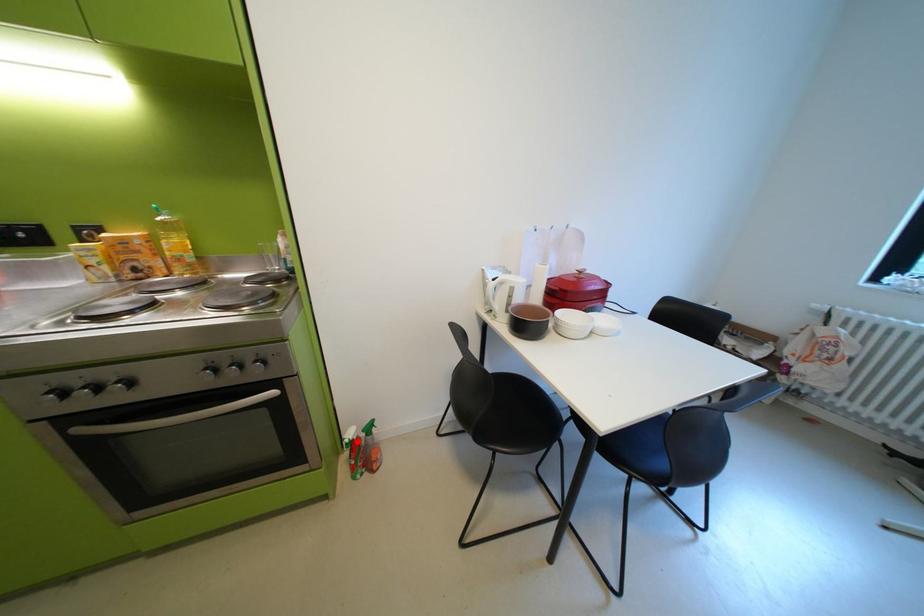
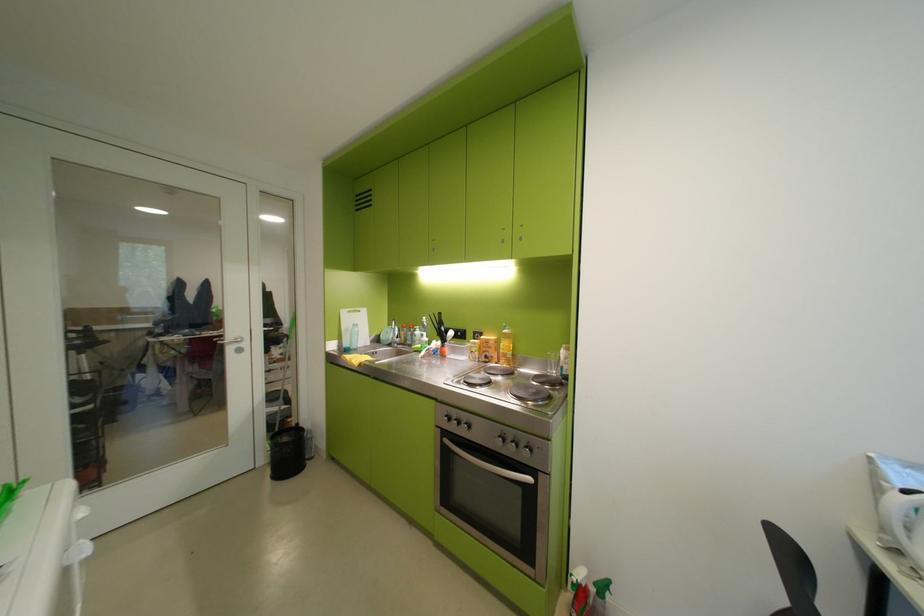
Find the pixel in the second image that matches the highlighted location in the first image.

(585, 581)